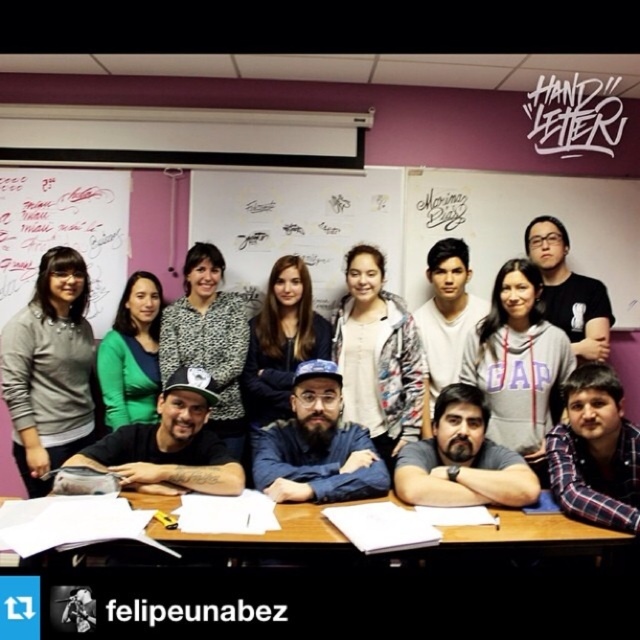
Question: Which object appears farthest from the camera in this image?

Choices:
 (A) whiteboard at upper left
 (B) black text at center
 (C) gray fleece jacket at upper left

Answer: (A)

Question: In this image, where is whiteboard at center located relative to whiteboard at upper left?

Choices:
 (A) right
 (B) left

Answer: (A)

Question: Does whiteboard at upper left have a larger size compared to black text at center?

Choices:
 (A) no
 (B) yes

Answer: (B)

Question: Does whiteboard at center have a smaller size compared to gray fleece hoodie at center?

Choices:
 (A) yes
 (B) no

Answer: (A)

Question: Which is nearer to the wooden table at center?

Choices:
 (A) black text at center
 (B) whiteboard at upper left
 (C) whiteboard at center
 (D) gray fleece hoodie at center

Answer: (A)

Question: Estimate the real-world distances between objects in this image. Which object is farther from the black text at center?

Choices:
 (A) gray fleece jacket at upper left
 (B) gray fleece hoodie at center
 (C) whiteboard at center
 (D) whiteboard at upper left

Answer: (D)